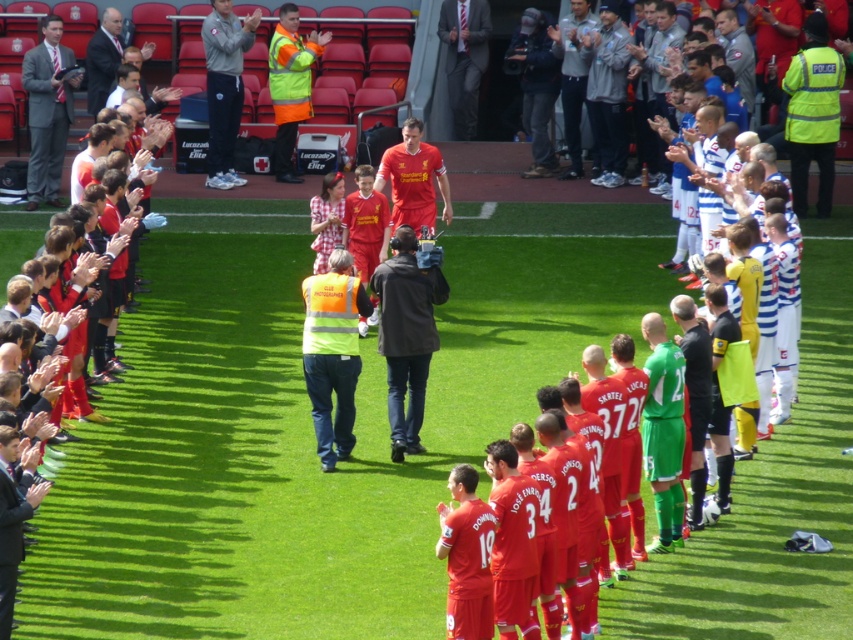
Can you confirm if matte red jersey at center is positioned to the right of gray fabric jacket at upper center?

Incorrect, matte red jersey at center is not on the right side of gray fabric jacket at upper center.

Does matte red jersey at center lie in front of gray fabric jacket at upper center?

Yes.

Image resolution: width=853 pixels, height=640 pixels. I want to click on matte red jersey at center, so click(413, 179).

The height and width of the screenshot is (640, 853). I want to click on matte red jersey at center, so click(x=413, y=179).

Is point (39, 481) positioned in front of point (561, 83)?

Yes, it is in front of point (561, 83).

Looking at this image, can you confirm if dark gray suit at lower left is taller than gray fabric jacket at upper center?

No, dark gray suit at lower left is not taller than gray fabric jacket at upper center.

Is point (9, 548) behind point (575, 4)?

That is False.

The image size is (853, 640). Find the location of `dark gray suit at lower left`. dark gray suit at lower left is located at coordinates (x=12, y=522).

Is matte black suit at left thinner than matte red jersey at center?

Yes, matte black suit at left is thinner than matte red jersey at center.

Does matte black suit at left appear on the right side of matte red jersey at center?

In fact, matte black suit at left is to the left of matte red jersey at center.

In the scene shown: Who is more forward, (44, 106) or (389, 161)?

Point (389, 161)

You are a GUI agent. You are given a task and a screenshot of the screen. Output one action in this format:
    pyautogui.click(x=<x>, y=<y>)
    Task: Click on the matte black suit at left
    The image size is (853, 640).
    Given the screenshot: What is the action you would take?
    pyautogui.click(x=47, y=112)